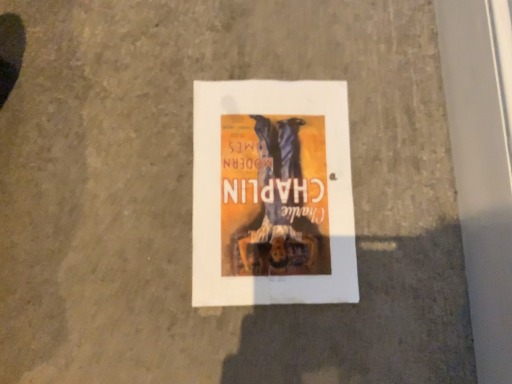
Identify the location of white paper poster at center. (272, 194).

The height and width of the screenshot is (384, 512). What do you see at coordinates (272, 194) in the screenshot?
I see `white paper poster at center` at bounding box center [272, 194].

Locate an element on the screen. The image size is (512, 384). white paper poster at center is located at coordinates (272, 194).